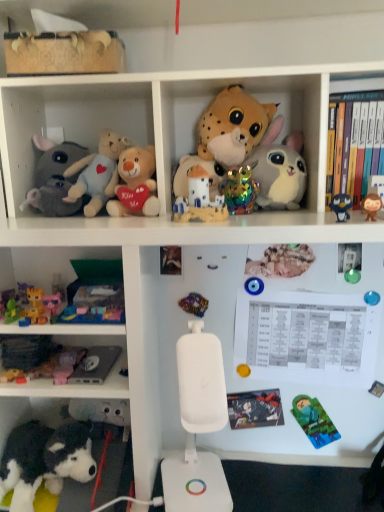
Question: Does matte ceramic castle at center, which is counted as the eighth toy, starting from the left, have a larger size compared to multicolored beads at center, which ranks as the eighth toy in right-to-left order?

Choices:
 (A) no
 (B) yes

Answer: (B)

Question: Is matte ceramic castle at center, which is counted as the eighth toy, starting from the left, completely or partially outside of multicolored beads at center, the 7th toy positioned from the left?

Choices:
 (A) no
 (B) yes

Answer: (B)

Question: Considering the relative sizes of matte ceramic castle at center, which is counted as the eighth toy, starting from the left, and multicolored beads at center, the 7th toy positioned from the left, in the image provided, is matte ceramic castle at center, which is counted as the eighth toy, starting from the left, thinner than multicolored beads at center, the 7th toy positioned from the left,?

Choices:
 (A) no
 (B) yes

Answer: (A)

Question: From a real-world perspective, is matte ceramic castle at center, which is counted as the eighth toy, starting from the left, physically below multicolored beads at center, which ranks as the eighth toy in right-to-left order?

Choices:
 (A) yes
 (B) no

Answer: (B)

Question: Is matte ceramic castle at center, which is counted as the eighth toy, starting from the left, in contact with multicolored beads at center, the 7th toy positioned from the left?

Choices:
 (A) no
 (B) yes

Answer: (A)

Question: Is matte ceramic castle at center, the 7th toy when ordered from right to left, taller than multicolored beads at center, the 7th toy positioned from the left?

Choices:
 (A) yes
 (B) no

Answer: (A)

Question: Does holographic plastic toy at center, which ranks as the 5th toy in right-to-left order, have a greater width compared to matt black comic book at center, placed as the 1th book when sorted from left to right?

Choices:
 (A) no
 (B) yes

Answer: (B)

Question: From the image's perspective, is holographic plastic toy at center, arranged as the tenth toy when viewed from the left, on top of matt black comic book at center, placed as the first book when sorted from bottom to top?

Choices:
 (A) yes
 (B) no

Answer: (A)

Question: Would you consider holographic plastic toy at center, which ranks as the 5th toy in right-to-left order, to be distant from matt black comic book at center, placed as the first book when sorted from bottom to top?

Choices:
 (A) no
 (B) yes

Answer: (A)

Question: From the image's perspective, does holographic plastic toy at center, which ranks as the 5th toy in right-to-left order, appear lower than matt black comic book at center, the second book when ordered from top to bottom?

Choices:
 (A) no
 (B) yes

Answer: (A)

Question: Does holographic plastic toy at center, which ranks as the 5th toy in right-to-left order, contain matt black comic book at center, placed as the first book when sorted from bottom to top?

Choices:
 (A) no
 (B) yes

Answer: (A)

Question: Is holographic plastic toy at center, arranged as the tenth toy when viewed from the left, to the right of matt black comic book at center, the second book when ordered from top to bottom, from the viewer's perspective?

Choices:
 (A) no
 (B) yes

Answer: (A)

Question: Does green plastic ball at upper right, which ranks as the second toy in right-to-left order, lie behind hardcover book at upper right, which ranks as the 1th book in right-to-left order?

Choices:
 (A) yes
 (B) no

Answer: (A)